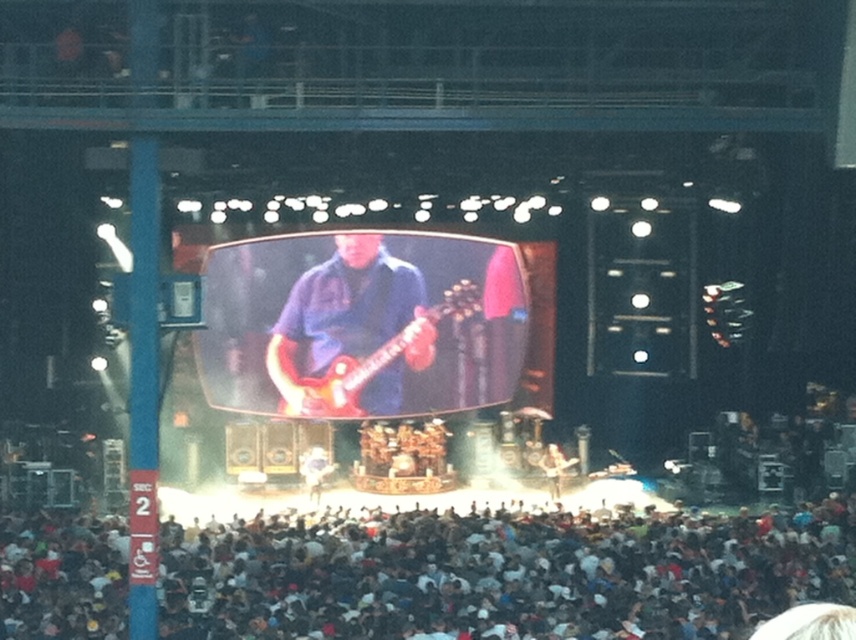
You are a photographer at the concert and want to capture the crowd. Where is the white cotton crowd at lower center positioned relative to the stage?

The white cotton crowd at lower center is positioned at point coordinates [503,573] relative to the stage.